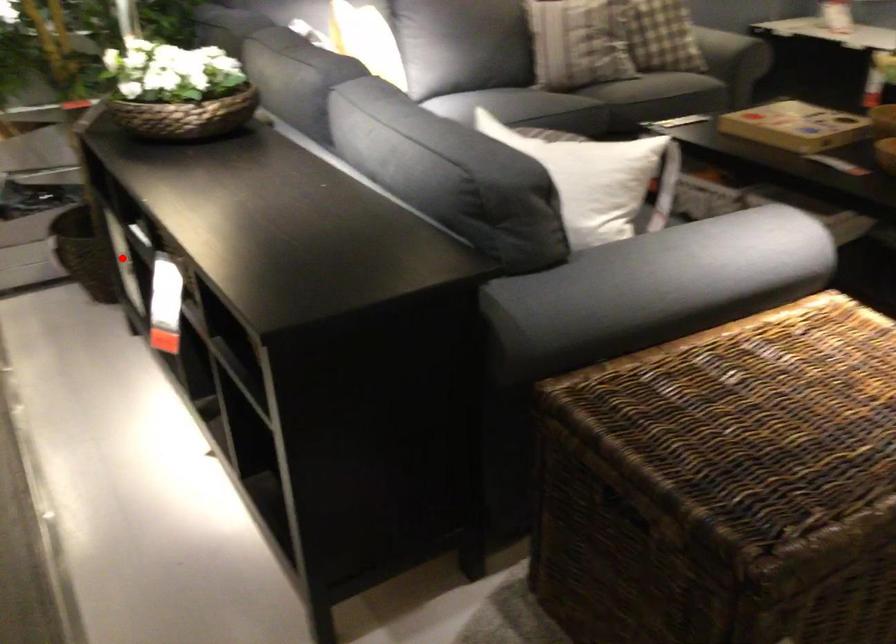
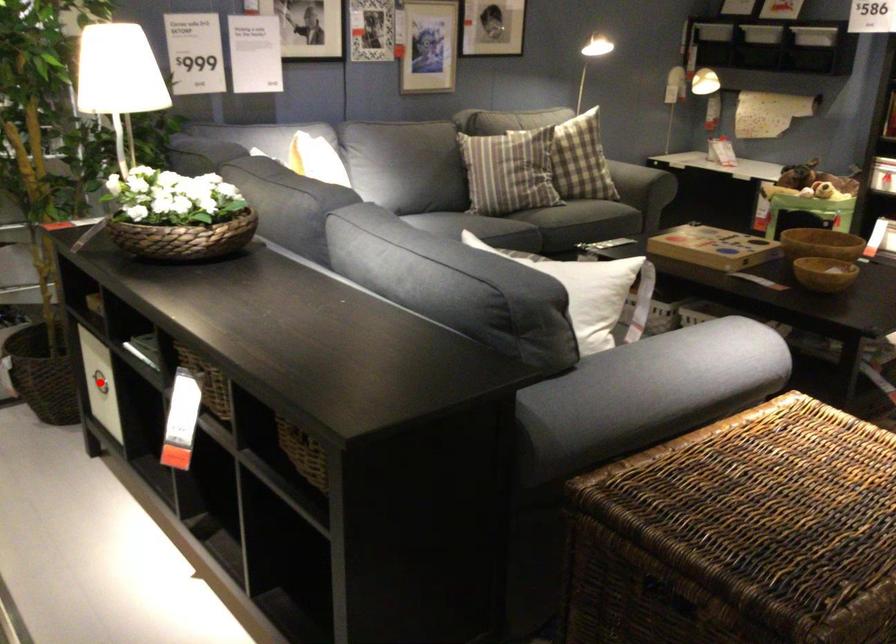
I am providing you with two images of the same scene from different viewpoints. A red point is marked on the first image and another point is marked on the second image. Is the red point in image1 aligned with the point shown in image2?

Yes